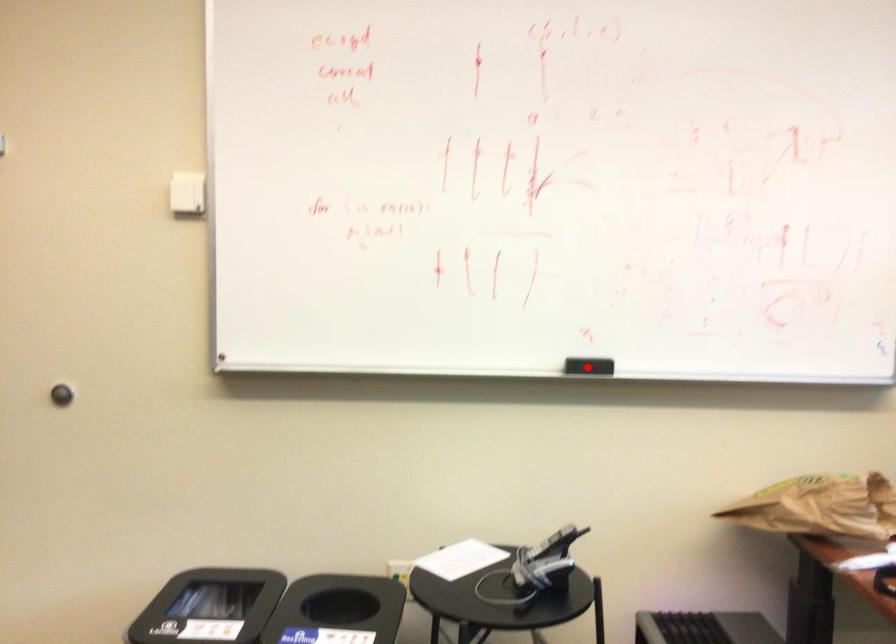
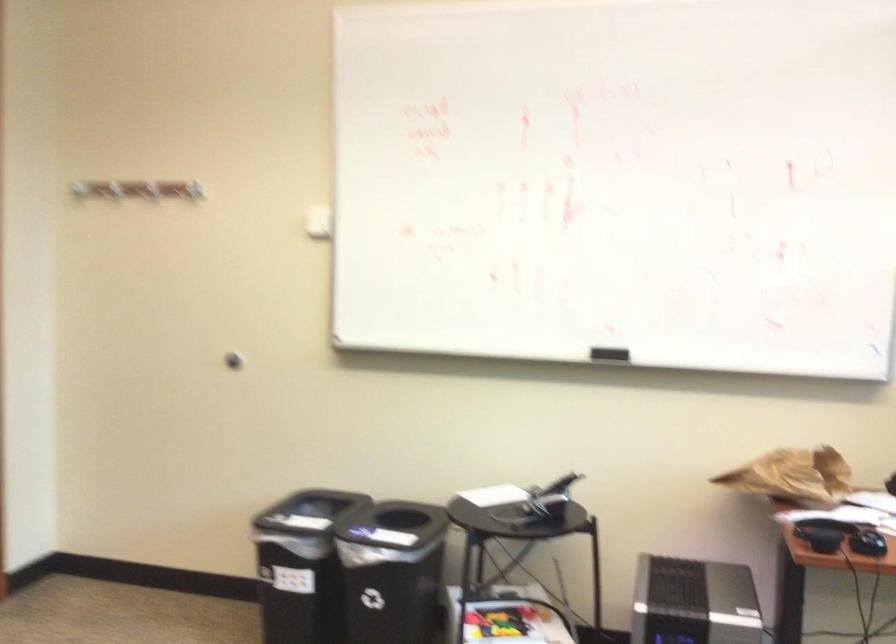
Question: A red point is marked in image1. In image2, is the corresponding 3D point closer to the camera or farther? Reply with the corresponding letter.

Choices:
 (A) The corresponding 3D point is closer.
 (B) The corresponding 3D point is farther.

Answer: (B)